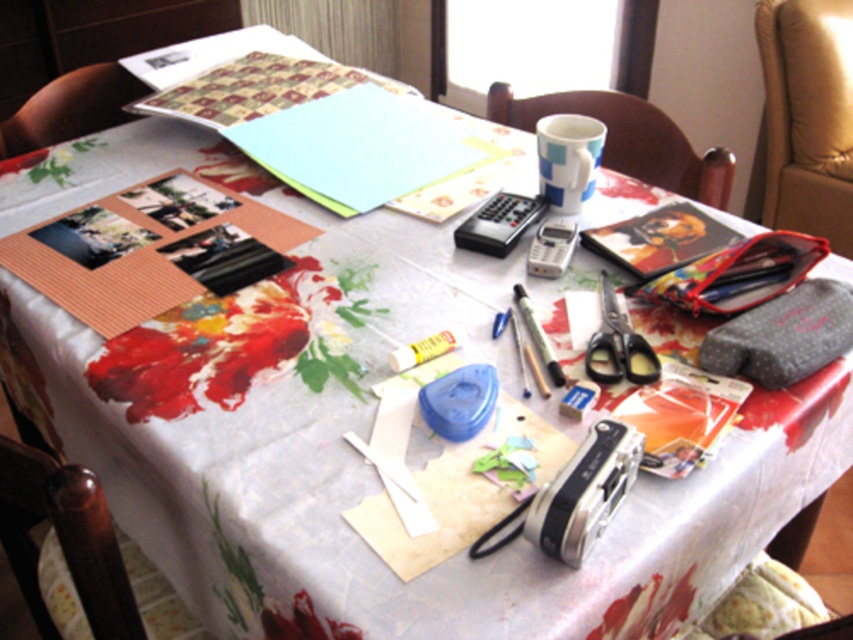
You are sitting at the table and want to move to the brown wood chair at lower left. Which direction should you move relative to the wooden chair at upper left?

The brown wood chair at lower left is positioned on the right side of the wooden chair at upper left, so you should move to the right relative to the wooden chair at upper left to reach the brown wood chair at lower left.